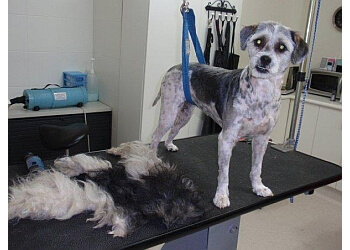
Locate an element on the screen. This screenshot has width=350, height=250. wall clock is located at coordinates (338, 19).